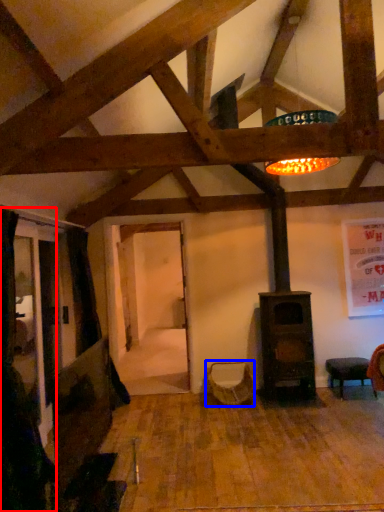
Question: Among these objects, which one is nearest to the camera, curtain (highlighted by a red box) or swivel chair (highlighted by a blue box)?

Choices:
 (A) curtain
 (B) swivel chair

Answer: (A)